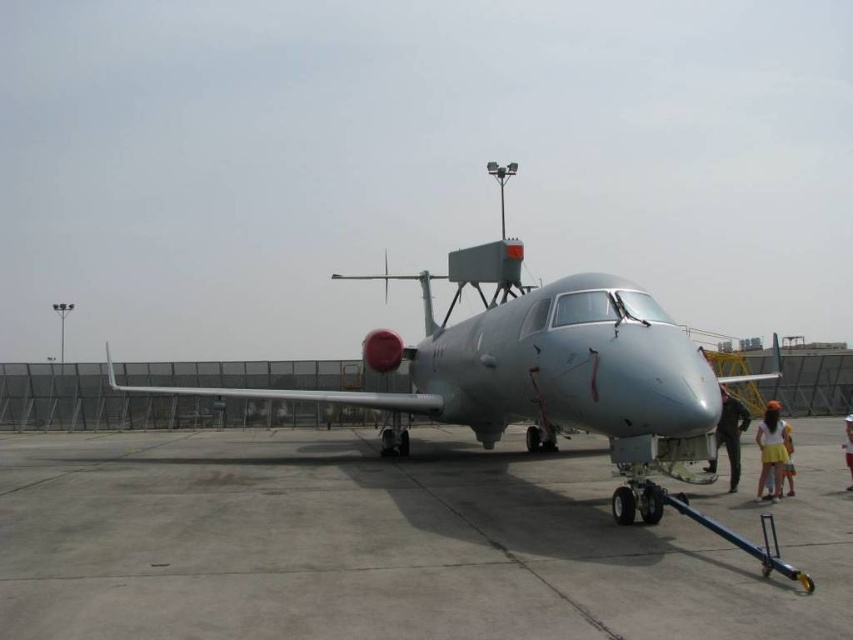
Does gray concrete tarmac at center appear on the right side of black fabric person at lower right?

Incorrect, gray concrete tarmac at center is not on the right side of black fabric person at lower right.

Is gray concrete tarmac at center taller than black fabric person at lower right?

Indeed, gray concrete tarmac at center has a greater height compared to black fabric person at lower right.

Where is `gray concrete tarmac at center`? The height and width of the screenshot is (640, 853). gray concrete tarmac at center is located at coordinates (392, 541).

At what (x,y) coordinates should I click in order to perform the action: click on gray concrete tarmac at center. Please return your answer as a coordinate pair (x, y). The image size is (853, 640). Looking at the image, I should click on (392, 541).

Does sleek metallic airplane at center have a larger size compared to black fabric person at lower right?

Indeed, sleek metallic airplane at center has a larger size compared to black fabric person at lower right.

Looking at this image, can you confirm if sleek metallic airplane at center is smaller than black fabric person at lower right?

Incorrect, sleek metallic airplane at center is not smaller in size than black fabric person at lower right.

Is point (689, 342) behind point (737, 408)?

That is False.

Where is `sleek metallic airplane at center`? sleek metallic airplane at center is located at coordinates click(534, 364).

Can you confirm if yellow fabric skirt at lower right is positioned above white cotton shirt at center?

Yes, yellow fabric skirt at lower right is above white cotton shirt at center.

Between yellow fabric skirt at lower right and white cotton shirt at center, which one appears on the left side from the viewer's perspective?

Positioned to the left is yellow fabric skirt at lower right.

Does point (778, 436) come behind point (845, 436)?

No, it is not.

Find the location of a particular element. Image resolution: width=853 pixels, height=640 pixels. yellow fabric skirt at lower right is located at coordinates tap(772, 451).